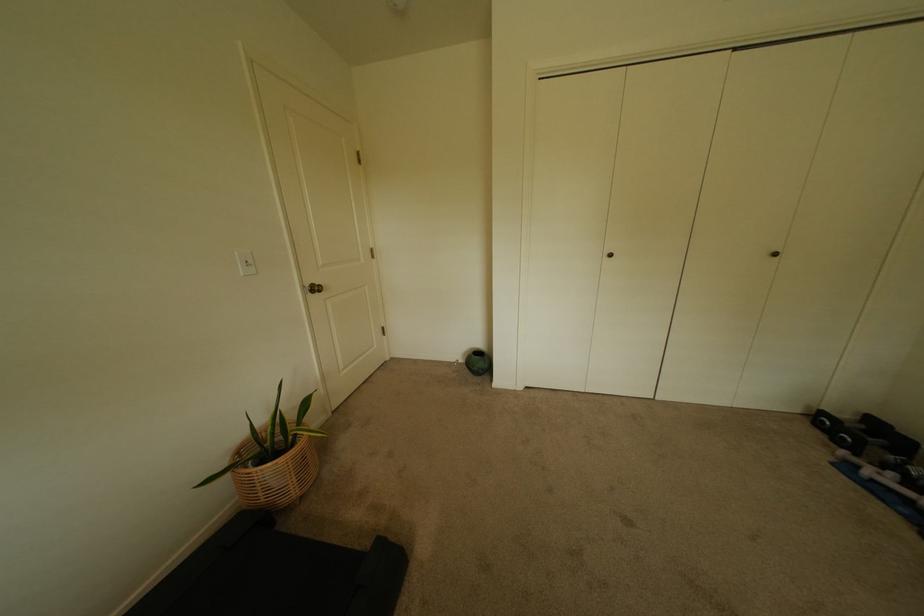
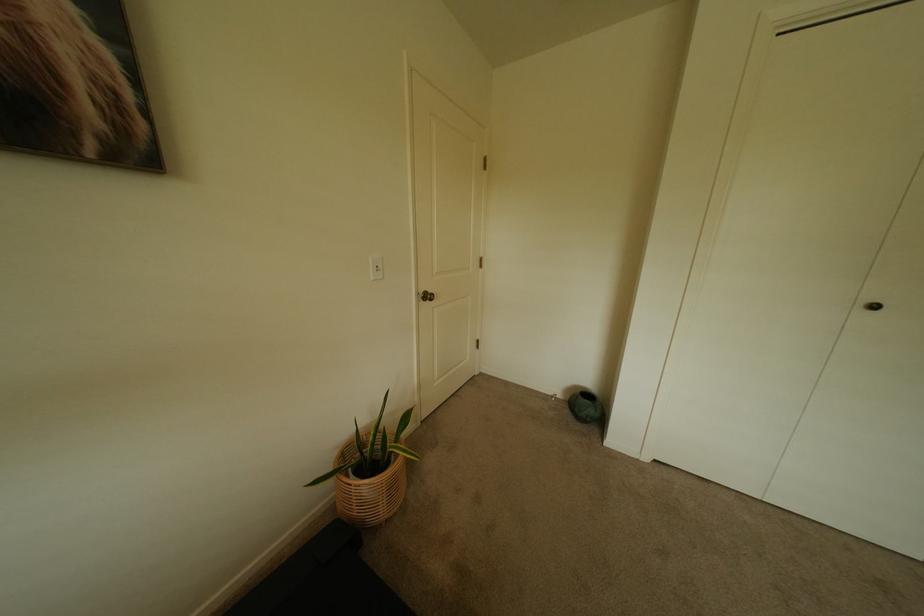
Question: The camera is either moving clockwise (left) or counter-clockwise (right) around the object. The first image is from the beginning of the video and the second image is from the end. Is the camera moving left or right when shooting the video?

Choices:
 (A) Left
 (B) Right

Answer: (B)